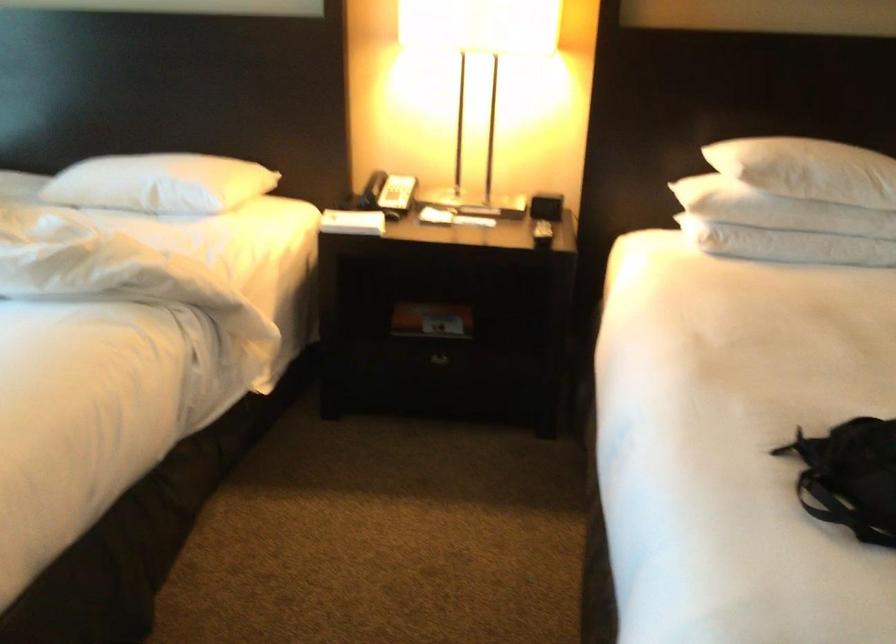
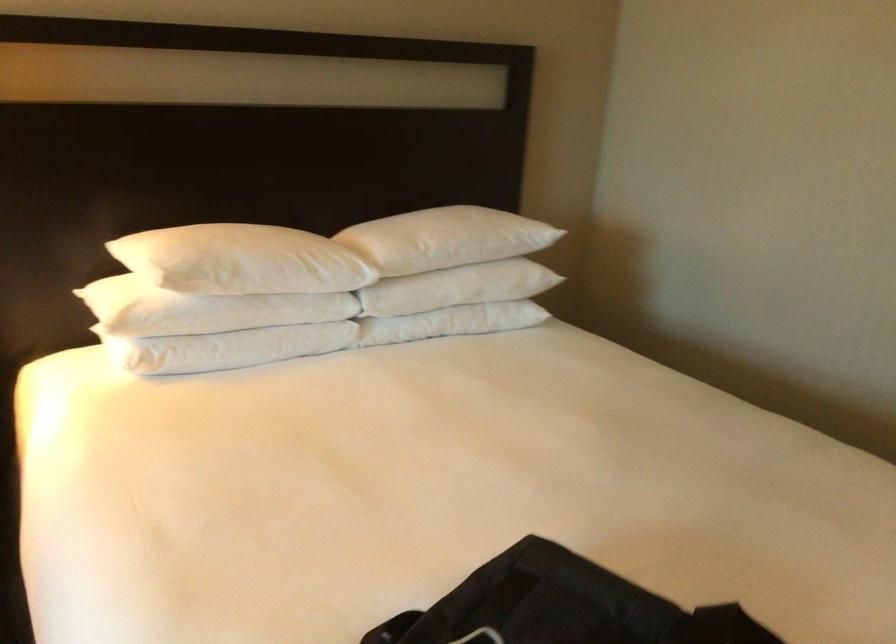
The point at (778, 236) is marked in the first image. Where is the corresponding point in the second image?

(226, 348)